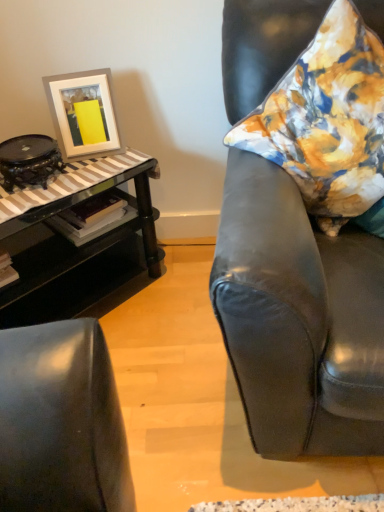
Locate an element on the screen. The width and height of the screenshot is (384, 512). white matte picture frame at upper left is located at coordinates (83, 112).

Find the location of a particular element. floral fabric pillow at right is located at coordinates (327, 118).

Identify the location of black glass table at left. (81, 251).

Looking at this image, is white matte picture frame at upper left situated inside matte black armchair at right or outside?

white matte picture frame at upper left cannot be found inside matte black armchair at right.

Between white matte picture frame at upper left and matte black armchair at right, which one has larger size?

Bigger between the two is matte black armchair at right.

Is white matte picture frame at upper left oriented away from matte black armchair at right?

white matte picture frame at upper left is not turned away from matte black armchair at right.

Looking at this image, considering the positions of objects white matte picture frame at upper left and matte black armchair at right in the image provided, who is in front, white matte picture frame at upper left or matte black armchair at right?

Positioned in front is matte black armchair at right.

From a real-world perspective, is matte black armchair at right on top of white matte picture frame at upper left?

No, from a real-world perspective, matte black armchair at right is not on top of white matte picture frame at upper left.

From their relative heights in the image, would you say matte black armchair at right is taller or shorter than white matte picture frame at upper left?

In the image, matte black armchair at right appears to be taller than white matte picture frame at upper left.

Do you think matte black armchair at right is within white matte picture frame at upper left, or outside of it?

matte black armchair at right is outside white matte picture frame at upper left.

Which object is thinner, matte black armchair at right or white matte picture frame at upper left?

Thinner between the two is white matte picture frame at upper left.

From the image's perspective, is black glass table at left below floral fabric pillow at right?

Indeed, from the image's perspective, black glass table at left is shown beneath floral fabric pillow at right.

Is black glass table at left bigger than floral fabric pillow at right?

Correct, black glass table at left is larger in size than floral fabric pillow at right.

Considering their positions, is black glass table at left located in front of or behind floral fabric pillow at right?

black glass table at left is positioned farther from the viewer than floral fabric pillow at right.

From a real-world perspective, is black glass table at left on floral fabric pillow at right?

No, from a real-world perspective, black glass table at left is not on top of floral fabric pillow at right.

From a real-world perspective, is floral fabric pillow at right on top of black glass table at left?

Yes, from a real-world perspective, floral fabric pillow at right is over black glass table at left

Which of these two, floral fabric pillow at right or black glass table at left, is bigger?

black glass table at left is bigger.

Could you tell me if floral fabric pillow at right is turned towards black glass table at left?

No, floral fabric pillow at right does not turn towards black glass table at left.

Based on their sizes in the image, would you say matte black armchair at right is bigger or smaller than floral fabric pillow at right?

matte black armchair at right is bigger than floral fabric pillow at right.

How much distance is there between matte black armchair at right and floral fabric pillow at right?

matte black armchair at right and floral fabric pillow at right are 17.03 centimeters apart.

From a real-world perspective, which is physically below, matte black armchair at right or floral fabric pillow at right?

matte black armchair at right.

Based on the photo, how many degrees apart are the facing directions of black glass table at left and white matte picture frame at upper left?

The angular difference between black glass table at left and white matte picture frame at upper left is 25.7 degrees.

From a real-world perspective, who is located higher, black glass table at left or white matte picture frame at upper left?

white matte picture frame at upper left is physically above.

Does black glass table at left turn towards white matte picture frame at upper left?

No, black glass table at left is not facing towards white matte picture frame at upper left.

In terms of size, does black glass table at left appear bigger or smaller than white matte picture frame at upper left?

black glass table at left is bigger than white matte picture frame at upper left.

How far apart are floral fabric pillow at right and matte black armchair at right?

floral fabric pillow at right and matte black armchair at right are 6.70 inches apart.

Can you confirm if floral fabric pillow at right is taller than matte black armchair at right?

In fact, floral fabric pillow at right may be shorter than matte black armchair at right.

Does point (312, 22) appear closer or farther from the camera than point (362, 285)?

Clearly, point (312, 22) is more distant from the camera than point (362, 285).

Locate an element on the screen. The image size is (384, 512). picture frame that is on the left side of matte black armchair at right is located at coordinates click(x=83, y=112).

In the image, there is a white matte picture frame at upper left. Identify the location of chair below it (from the image's perspective). This screenshot has height=512, width=384. (298, 318).

Estimate the real-world distances between objects in this image. Which object is further from floral fabric pillow at right, white matte picture frame at upper left or black glass table at left?

white matte picture frame at upper left is positioned further to the anchor floral fabric pillow at right.

Estimate the real-world distances between objects in this image. Which object is closer to floral fabric pillow at right, black glass table at left or matte black armchair at right?

matte black armchair at right lies closer to floral fabric pillow at right than the other object.

Estimate the real-world distances between objects in this image. Which object is further from matte black armchair at right, floral fabric pillow at right or white matte picture frame at upper left?

white matte picture frame at upper left is positioned further to the anchor matte black armchair at right.

Which object lies nearer to the anchor point matte black armchair at right, white matte picture frame at upper left or black glass table at left?

black glass table at left lies closer to matte black armchair at right than the other object.

When comparing their distances from black glass table at left, does floral fabric pillow at right or matte black armchair at right seem closer?

floral fabric pillow at right.

Considering their positions, is white matte picture frame at upper left positioned further to matte black armchair at right than floral fabric pillow at right?

Based on the image, white matte picture frame at upper left appears to be further to matte black armchair at right.

Looking at the image, which one is located closer to black glass table at left, matte black armchair at right or floral fabric pillow at right?

The object closer to black glass table at left is floral fabric pillow at right.

From the image, which object appears to be nearer to floral fabric pillow at right, matte black armchair at right or black glass table at left?

matte black armchair at right lies closer to floral fabric pillow at right than the other object.

Locate an element on the screen. pillow between black glass table at left and matte black armchair at right from left to right is located at coordinates (327, 118).

Where is `pillow between matte black armchair at right and white matte picture frame at upper left in the front-back direction`? This screenshot has width=384, height=512. pillow between matte black armchair at right and white matte picture frame at upper left in the front-back direction is located at coordinates (327, 118).

You are a GUI agent. You are given a task and a screenshot of the screen. Output one action in this format:
    pyautogui.click(x=<x>, y=<y>)
    Task: Click on the picture frame between black glass table at left and matte black armchair at right from left to right
    Image resolution: width=384 pixels, height=512 pixels.
    Given the screenshot: What is the action you would take?
    pyautogui.click(x=83, y=112)

This screenshot has width=384, height=512. In order to click on picture frame situated between black glass table at left and floral fabric pillow at right from left to right in this screenshot , I will do `click(83, 112)`.